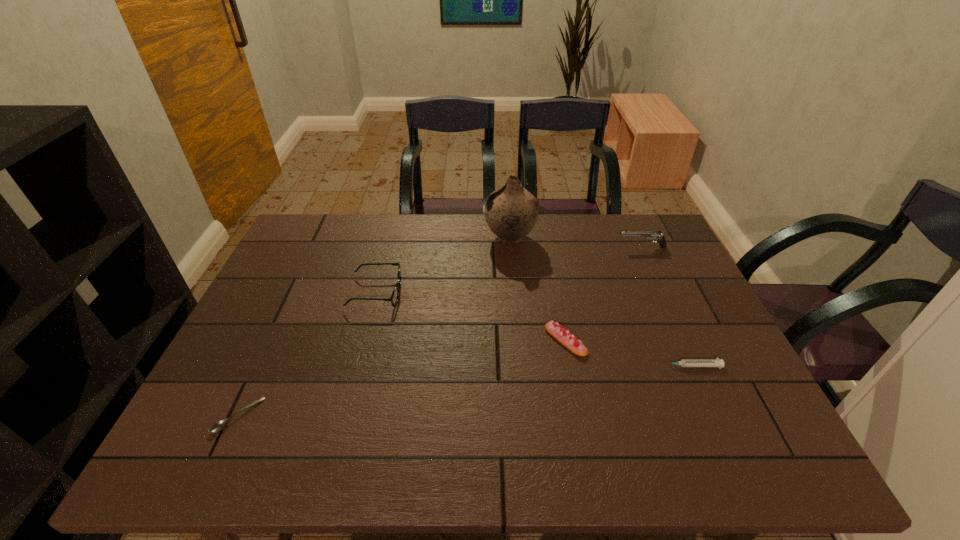
Locate an element on the screen. pottery is located at coordinates (511, 211).

The height and width of the screenshot is (540, 960). Find the location of `the fifth shortest object`. the fifth shortest object is located at coordinates (656, 235).

At what (x,y) coordinates should I click in order to perform the action: click on the second object from left to right. Please return your answer as a coordinate pair (x, y). The width and height of the screenshot is (960, 540). Looking at the image, I should click on (395, 295).

Where is `the fourth shortest object`? the fourth shortest object is located at coordinates (395, 295).

The image size is (960, 540). Identify the location of eclair. (566, 338).

Where is `the third nearest object`? Image resolution: width=960 pixels, height=540 pixels. the third nearest object is located at coordinates [566, 338].

You are a GUI agent. You are given a task and a screenshot of the screen. Output one action in this format:
    pyautogui.click(x=<x>, y=<y>)
    Task: Click on the fifth tallest object
    
    Given the screenshot: What is the action you would take?
    pyautogui.click(x=717, y=362)

Where is `syringe`? The image size is (960, 540). syringe is located at coordinates (717, 362).

The height and width of the screenshot is (540, 960). In order to click on the nearest object in this screenshot , I will do `click(220, 425)`.

Locate an element on the screen. This screenshot has width=960, height=540. the leftmost object is located at coordinates (220, 425).